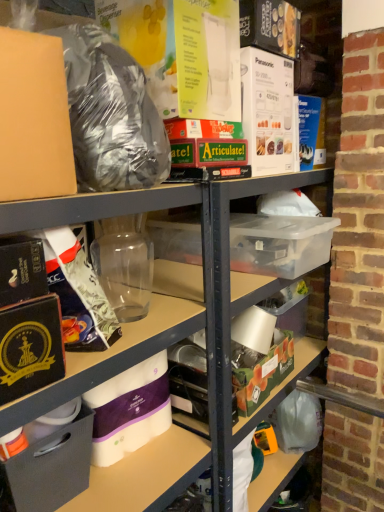
Question: Would you say matte black box at lower left, positioned as the second box in right-to-left order, is inside or outside green matte box at center, the 1th box viewed from the back?

Choices:
 (A) outside
 (B) inside

Answer: (A)

Question: Considering the positions of point (76, 433) and point (281, 342), is point (76, 433) closer or farther from the camera than point (281, 342)?

Choices:
 (A) farther
 (B) closer

Answer: (B)

Question: Considering the real-world distances, which object is closest to the green matte box at center, which ranks as the second box in front-to-back order?

Choices:
 (A) matte black bag at upper left
 (B) white matte toilet paper at lower center
 (C) matte black box at lower left, which ranks as the first box in front-to-back order

Answer: (B)

Question: Which object is positioned closest to the matte black box at lower left, positioned as the second box in right-to-left order?

Choices:
 (A) white matte toilet paper at lower center
 (B) matte black bag at upper left
 (C) green matte box at center, which ranks as the second box in front-to-back order

Answer: (A)